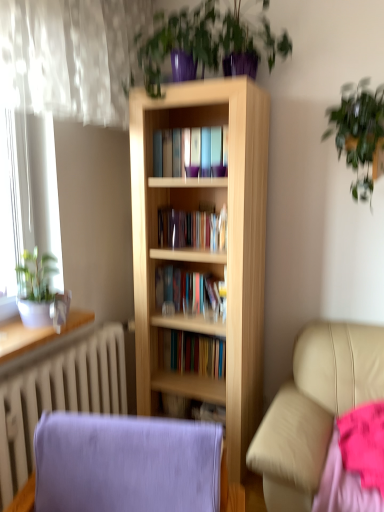
Question: From a real-world perspective, relative to pink fabric at lower right, is purple fabric rocking chair at lower left vertically above or below?

Choices:
 (A) above
 (B) below

Answer: (A)

Question: Which is correct: purple fabric rocking chair at lower left is inside pink fabric at lower right, or outside of it?

Choices:
 (A) outside
 (B) inside

Answer: (A)

Question: Considering the real-world distances, which object is farthest from the green leafy plant at upper right, the third houseplant in the left-to-right sequence?

Choices:
 (A) purple glossy plant at upper center, which is counted as the second houseplant, starting from the right
 (B) purple fabric rocking chair at lower left
 (C) green matte plant at left, which is the 3th houseplant from right to left
 (D) white glossy radiator at lower left
 (E) white matte radiator at lower left

Answer: (D)

Question: Which is farther from the white glossy radiator at lower left?

Choices:
 (A) green leafy plant at upper right, the 2th houseplant ordered from the bottom
 (B) purple fabric rocking chair at lower left
 (C) purple glossy plant at upper center, the first houseplant from the top
 (D) light wood bookcase at center
 (E) pink fabric at lower right

Answer: (A)